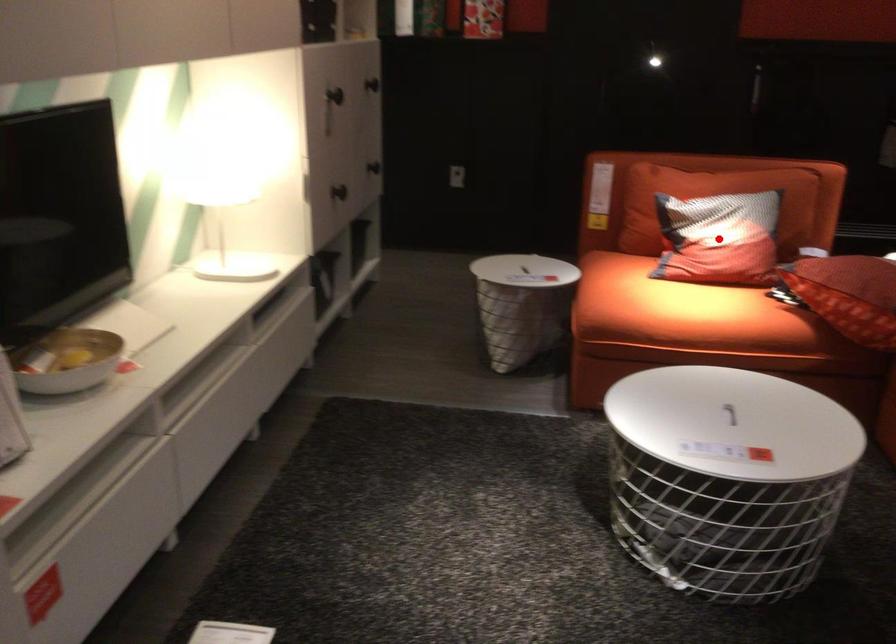
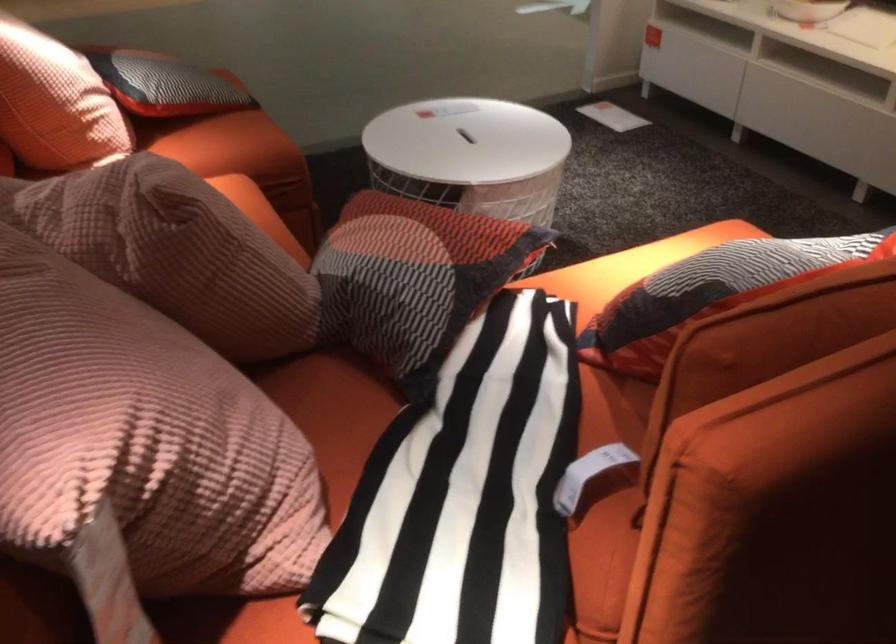
Question: I am providing you with two images of the same scene from different viewpoints. A red point is marked on the first image. At the location where the point appears in image 1, is it still visible in image 2?

Choices:
 (A) Yes
 (B) No

Answer: (B)